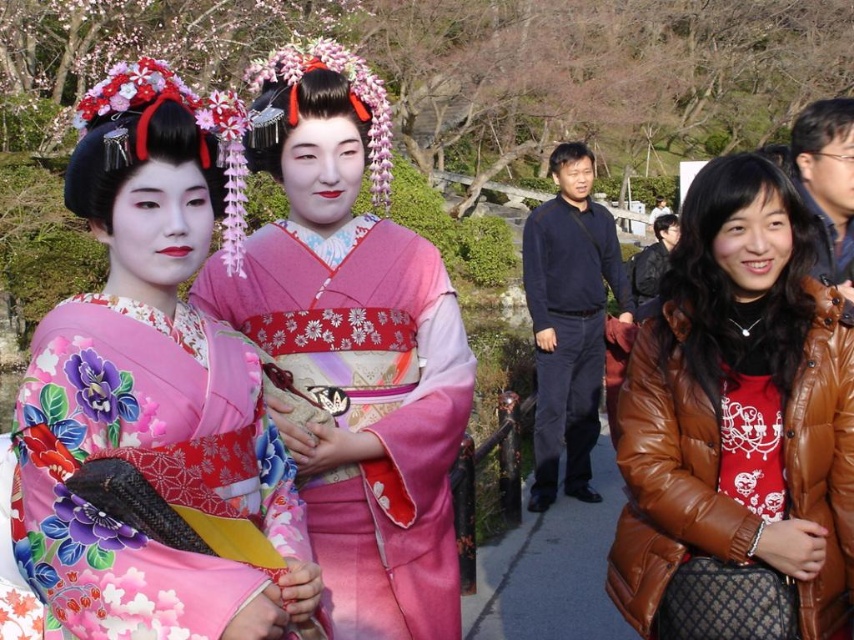
You are organizing a cultural exhibition and need to display both the matte kimono at left and the dark blue sweater at center. If you have a limited display area, which item should you prioritize placing first to ensure it fits without overlapping?

The matte kimono at left occupies less space than the dark blue sweater at center, so you should prioritize placing the dark blue sweater at center first to ensure it fits without overlapping.

You are a photographer setting up a shoot in a park. You have two subjects wearing different outfits. One is wearing a matte pink kimono at center and the other is wearing a brown leather jacket at right. You need to position a camera to capture both subjects in the frame. Which subject should you focus on first to ensure both are in the shot?

You should focus on the matte pink kimono at center first because the brown leather jacket at right is positioned to the right of it, so centering the matte pink kimono at center will naturally include the brown leather jacket at right within the frame.